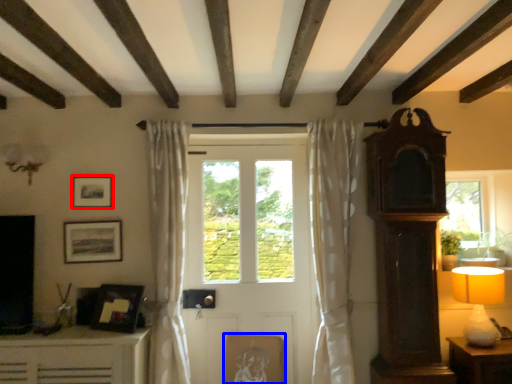
Question: Which object is closer to the camera taking this photo, picture frame (highlighted by a red box) or picture frame (highlighted by a blue box)?

Choices:
 (A) picture frame
 (B) picture frame

Answer: (A)